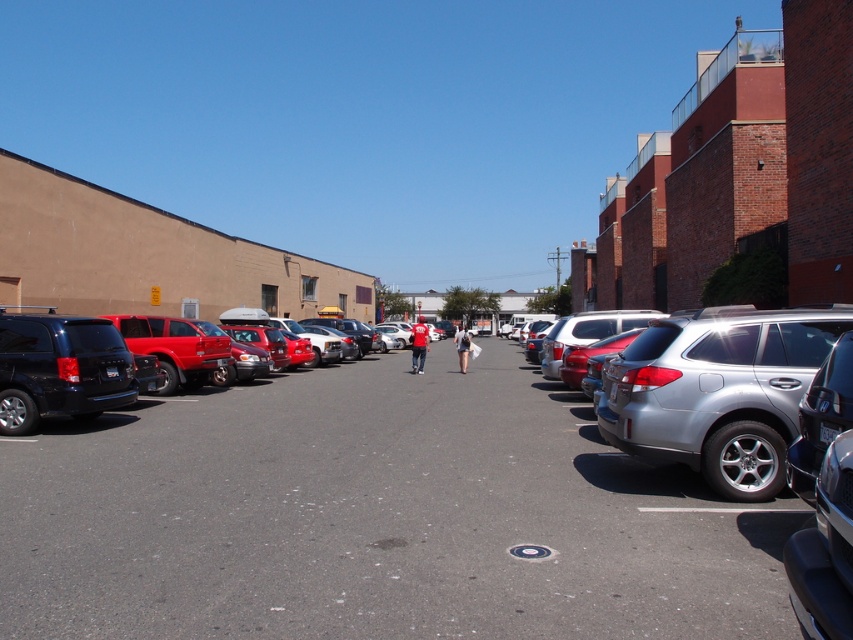
Question: Which object is farther from the camera taking this photo?

Choices:
 (A) matte black minivan at left
 (B) shiny black car at center

Answer: (A)

Question: Which point is farther from the camera taking this photo?

Choices:
 (A) tap(566, 508)
 (B) tap(25, 384)

Answer: (B)

Question: Is shiny black car at center to the right of matte black minivan at left from the viewer's perspective?

Choices:
 (A) no
 (B) yes

Answer: (B)

Question: Can you confirm if shiny black car at center is positioned to the right of matte black minivan at left?

Choices:
 (A) yes
 (B) no

Answer: (A)

Question: Is shiny black car at center behind matte black minivan at left?

Choices:
 (A) yes
 (B) no

Answer: (B)

Question: Which point is closer to the camera taking this photo?

Choices:
 (A) (123, 340)
 (B) (102, 536)

Answer: (B)